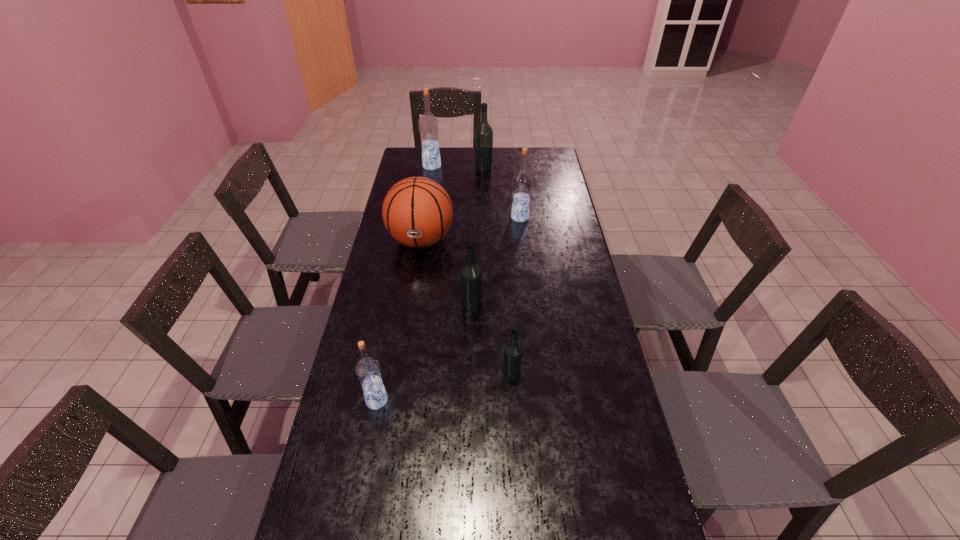
Locate an element on the screen. Image resolution: width=960 pixels, height=540 pixels. black vodka that is the second closest one to the farthest black vodka is located at coordinates (512, 358).

At what (x,y) coordinates should I click in order to perform the action: click on vacant area that satisfies the following two spatial constraints: 1. on the back side of the fourth nearest vodka; 2. on the left side of the nearest blue vodka. Please return your answer as a coordinate pair (x, y). Looking at the image, I should click on (412, 218).